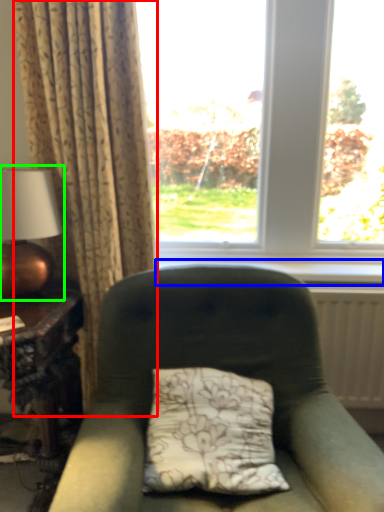
Question: Which object is the farthest from curtain (highlighted by a red box)? Choose among these: window sill (highlighted by a blue box) or table lamp (highlighted by a green box).

Choices:
 (A) window sill
 (B) table lamp

Answer: (A)